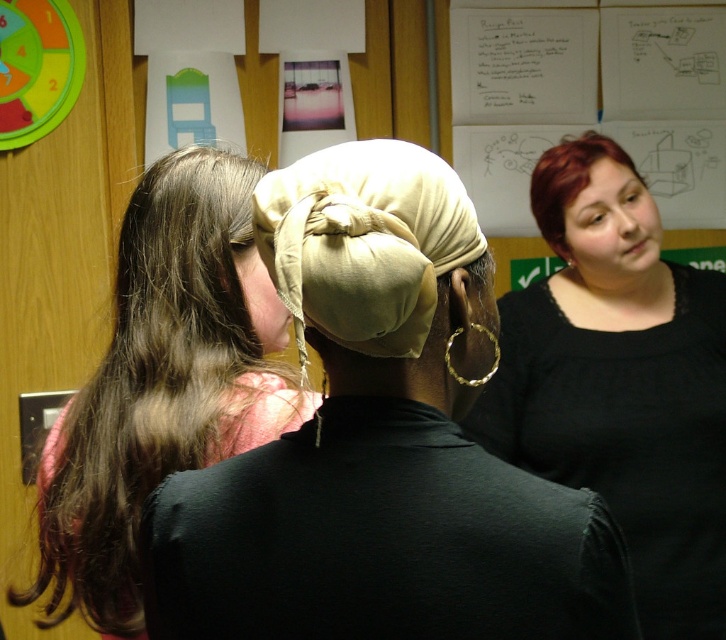
Question: Is dark brown hair at left positioned behind white paper at upper right?

Choices:
 (A) no
 (B) yes

Answer: (A)

Question: Can you confirm if matte black shirt at upper right is positioned to the left of white paper at upper right?

Choices:
 (A) yes
 (B) no

Answer: (A)

Question: Which object appears closest to the camera in this image?

Choices:
 (A) matte black shirt at upper right
 (B) white paper at upper right
 (C) matte black head at right
 (D) dark brown hair at left

Answer: (D)

Question: Considering the real-world distances, which object is closest to the beige fabric headscarf at center?

Choices:
 (A) dark brown hair at left
 (B) matte black head at right
 (C) white paper at upper right
 (D) matte black shirt at upper right

Answer: (A)

Question: Considering the relative positions of dark brown hair at left and white paper at upper right in the image provided, where is dark brown hair at left located with respect to white paper at upper right?

Choices:
 (A) below
 (B) above

Answer: (A)

Question: Which point appears farthest from the camera in this image?

Choices:
 (A) (605, 154)
 (B) (546, 102)
 (C) (91, 600)

Answer: (B)